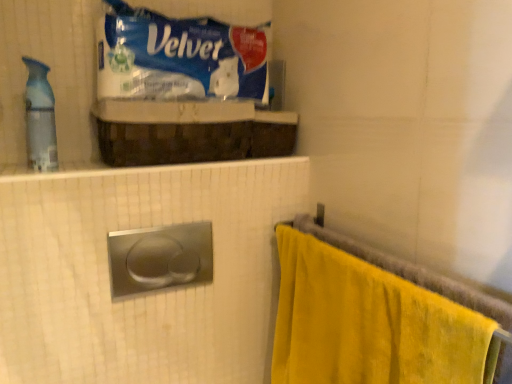
Question: Is blue plastic velver at upper center turned away from translucent plastic spray bottle at left?

Choices:
 (A) yes
 (B) no

Answer: (B)

Question: Is blue plastic velver at upper center thinner than translucent plastic spray bottle at left?

Choices:
 (A) no
 (B) yes

Answer: (A)

Question: Can you confirm if blue plastic velver at upper center is shorter than translucent plastic spray bottle at left?

Choices:
 (A) no
 (B) yes

Answer: (B)

Question: Is blue plastic velver at upper center smaller than translucent plastic spray bottle at left?

Choices:
 (A) no
 (B) yes

Answer: (A)

Question: Is blue plastic velver at upper center positioned in front of translucent plastic spray bottle at left?

Choices:
 (A) yes
 (B) no

Answer: (B)

Question: Is blue plastic velver at upper center in contact with translucent plastic spray bottle at left?

Choices:
 (A) yes
 (B) no

Answer: (B)

Question: Would you consider yellow velour towel at right to be distant from blue plastic velver at upper center?

Choices:
 (A) no
 (B) yes

Answer: (A)

Question: From the image's perspective, is yellow velour towel at right on blue plastic velver at upper center?

Choices:
 (A) yes
 (B) no

Answer: (B)

Question: Can you confirm if yellow velour towel at right is wider than blue plastic velver at upper center?

Choices:
 (A) yes
 (B) no

Answer: (B)

Question: Is yellow velour towel at right not inside blue plastic velver at upper center?

Choices:
 (A) yes
 (B) no

Answer: (A)

Question: Is yellow velour towel at right bigger than blue plastic velver at upper center?

Choices:
 (A) no
 (B) yes

Answer: (B)

Question: Is yellow velour towel at right positioned with its back to blue plastic velver at upper center?

Choices:
 (A) yes
 (B) no

Answer: (B)

Question: Can you confirm if translucent plastic spray bottle at left is shorter than blue plastic velver at upper center?

Choices:
 (A) no
 (B) yes

Answer: (A)